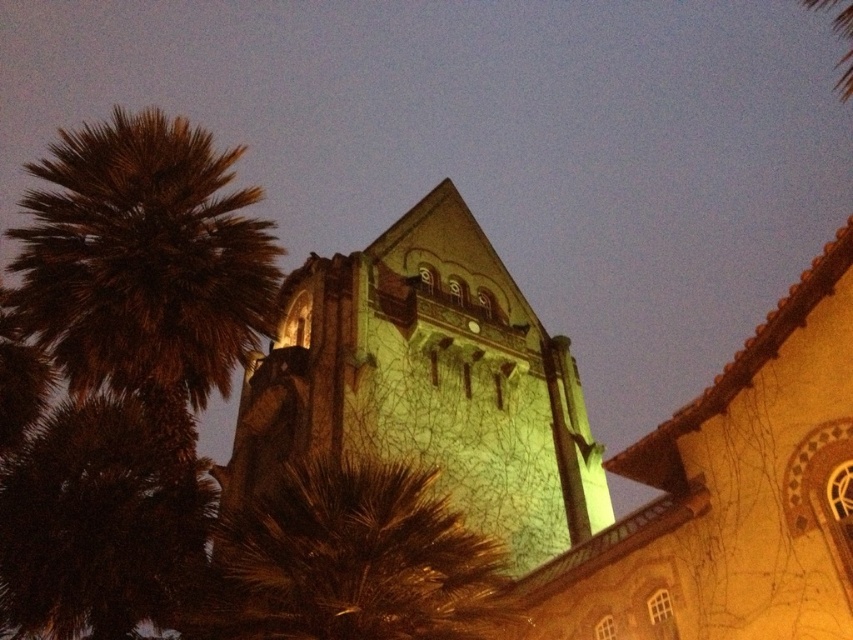
You are standing in front of the historic building and want to place a 25 meter long banner between the green stone tower at center and the brown fuzzy palm tree at left. Will the banner fit between them?

The distance between the green stone tower at center and the brown fuzzy palm tree at left is 24.12 meters, so the 25 meter long banner will not fit between them as it is longer than the available space.

You are an architect analyzing the building layout. The green stone tower at center and brown fuzzy palm tree at left are both visible from the front entrance. Which object appears narrower when viewed from that entrance?

The green stone tower at center appears narrower than the brown fuzzy palm tree at left because it has a lesser width compared to the palm tree.

You are an architect analyzing the layout of the building and the surrounding trees. Which object is located to the right of the other between the green stone tower at center and the brown fuzzy palm tree at left?

The green stone tower at center is positioned on the right side of the brown fuzzy palm tree at left.